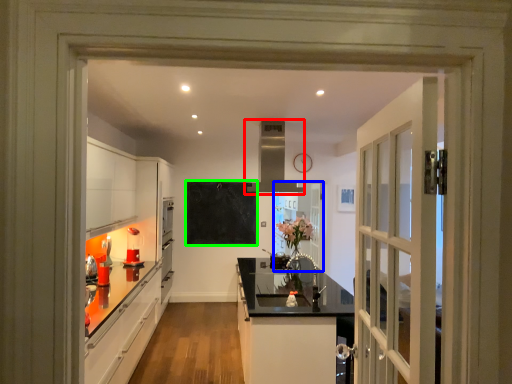
Question: Estimate the real-world distances between objects in this image. Which object is farther from exhaust hood (highlighted by a red box), door (highlighted by a blue box) or bulletin board (highlighted by a green box)?

Choices:
 (A) door
 (B) bulletin board

Answer: (A)